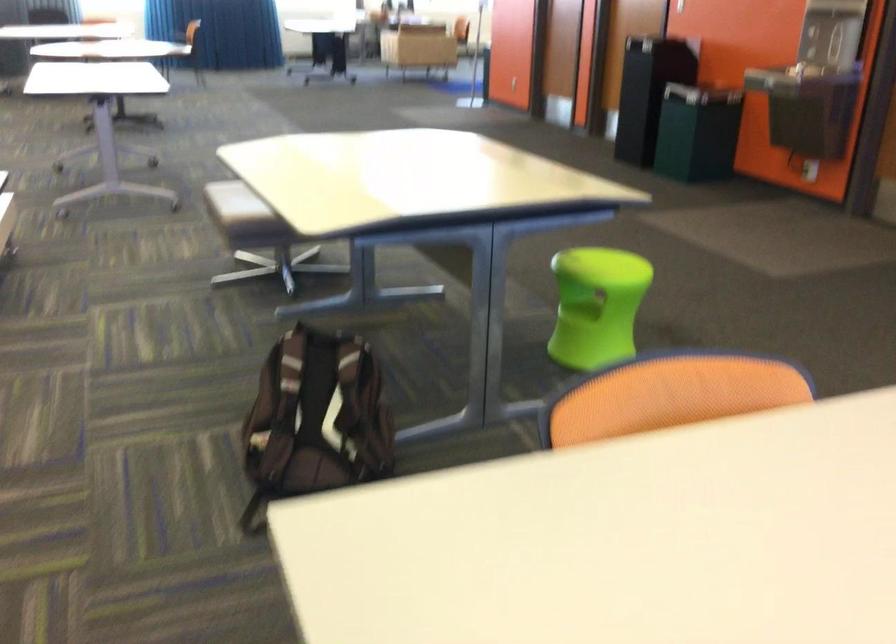
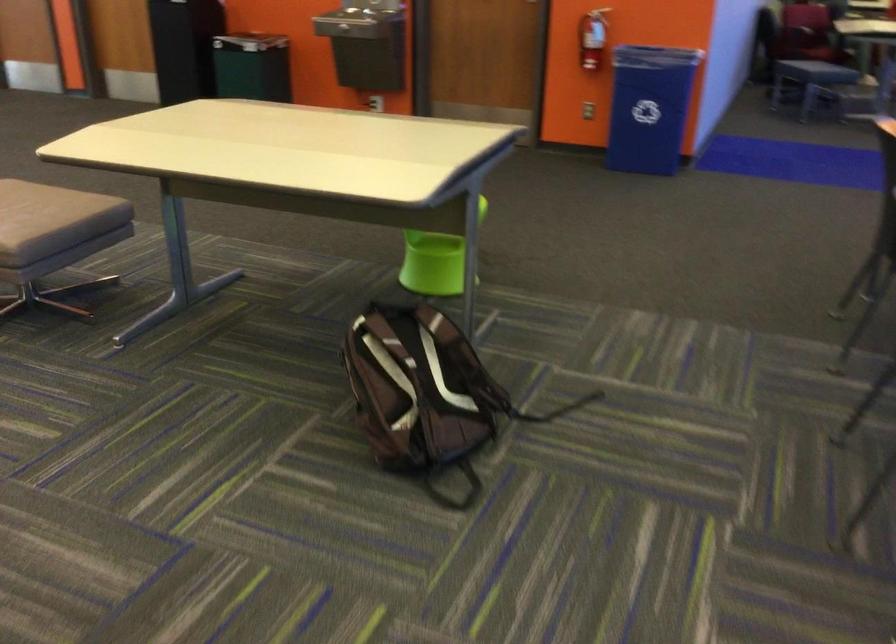
Where in the second image is the point corresponding to (x=288, y=418) from the first image?

(419, 392)